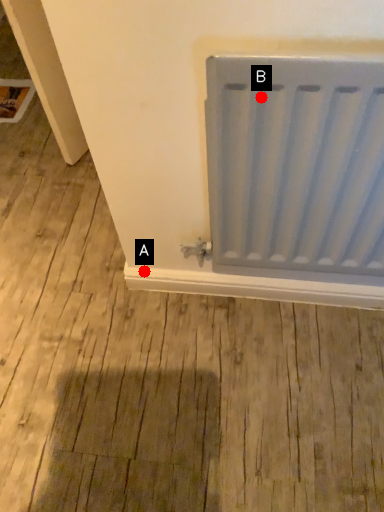
Question: Two points are circled on the image, labeled by A and B beside each circle. Which of the following is the closest to the observer?

Choices:
 (A) A is closer
 (B) B is closer

Answer: (B)